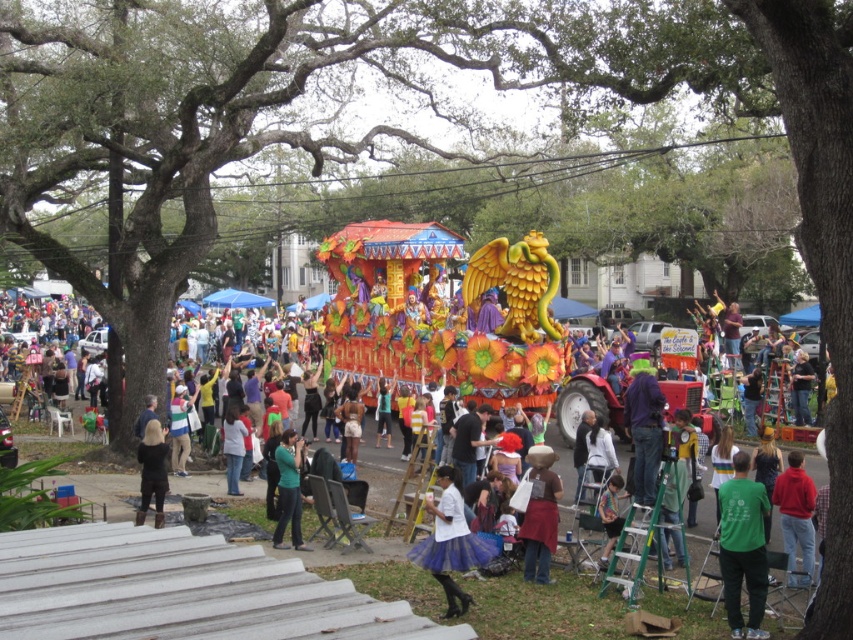
Question: Which is nearer to the brown fabric hat at center?

Choices:
 (A) green matte shirt at lower right
 (B) white cotton shirt at center

Answer: (B)

Question: Is brown fabric hat at center above black fabric at lower left?

Choices:
 (A) no
 (B) yes

Answer: (A)

Question: Is white cotton shirt at center below black fabric at lower left?

Choices:
 (A) yes
 (B) no

Answer: (A)

Question: Which of the following is the closest to the observer?

Choices:
 (A) white cotton shirt at center
 (B) black fabric at lower left

Answer: (A)

Question: Which object is the closest to the white cotton shirt at center?

Choices:
 (A) brown fabric hat at center
 (B) green matte shirt at lower right
 (C) black fabric at lower left

Answer: (A)

Question: Can you confirm if green matte shirt at lower right is positioned to the left of green matte shirt at center?

Choices:
 (A) yes
 (B) no

Answer: (B)